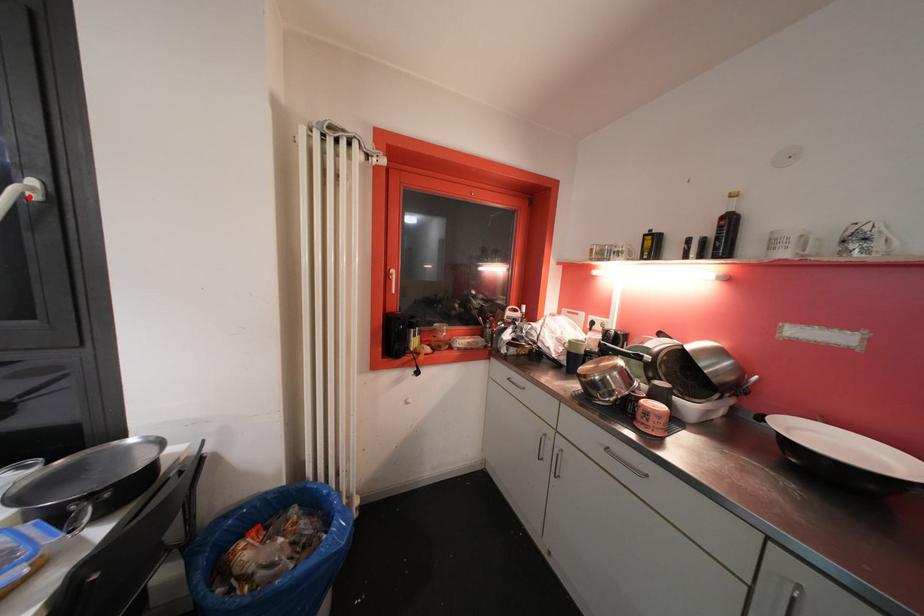
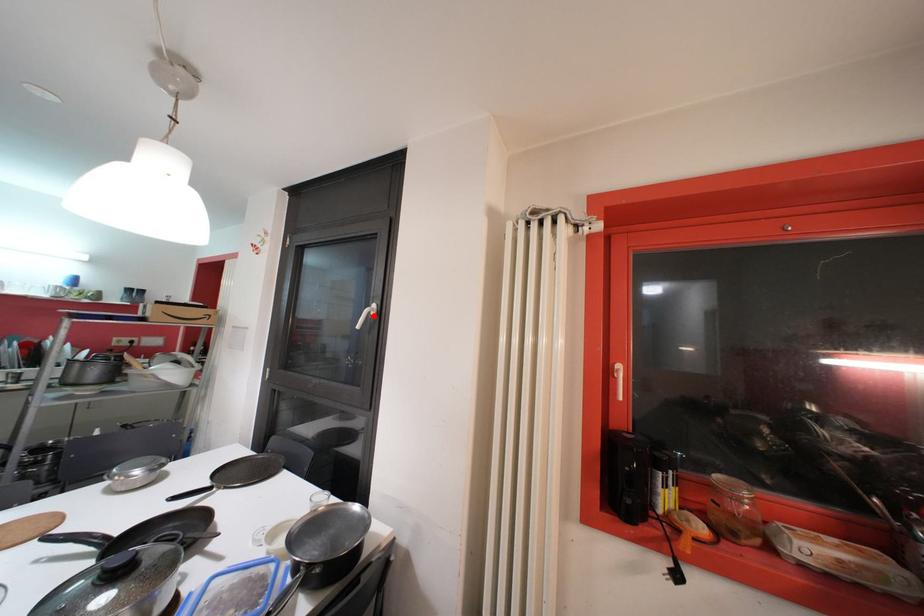
I am providing you with two images of the same scene from different viewpoints. A red point is marked on the first image and another point is marked on the second image. Does the point marked in image1 correspond to the same location as the one in image2?

Yes